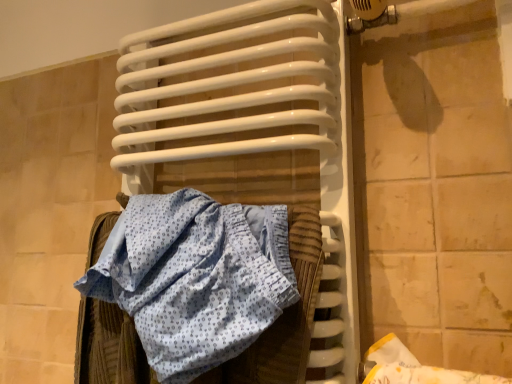
Question: From their relative heights in the image, would you say white glossy radiator at center is taller or shorter than blue printed fabric at center?

Choices:
 (A) short
 (B) tall

Answer: (B)

Question: Is white glossy radiator at center spatially inside blue printed fabric at center, or outside of it?

Choices:
 (A) inside
 (B) outside

Answer: (B)

Question: Based on their positions, is white glossy radiator at center located to the left or right of blue printed fabric at center?

Choices:
 (A) right
 (B) left

Answer: (A)

Question: Considering the positions of point (227, 357) and point (158, 49), is point (227, 357) closer or farther from the camera than point (158, 49)?

Choices:
 (A) closer
 (B) farther

Answer: (A)

Question: Looking at the image, does blue printed fabric at center seem bigger or smaller compared to white glossy radiator at center?

Choices:
 (A) small
 (B) big

Answer: (A)

Question: From a real-world perspective, is blue printed fabric at center above or below white glossy radiator at center?

Choices:
 (A) below
 (B) above

Answer: (A)

Question: Is blue printed fabric at center inside the boundaries of white glossy radiator at center, or outside?

Choices:
 (A) outside
 (B) inside

Answer: (B)